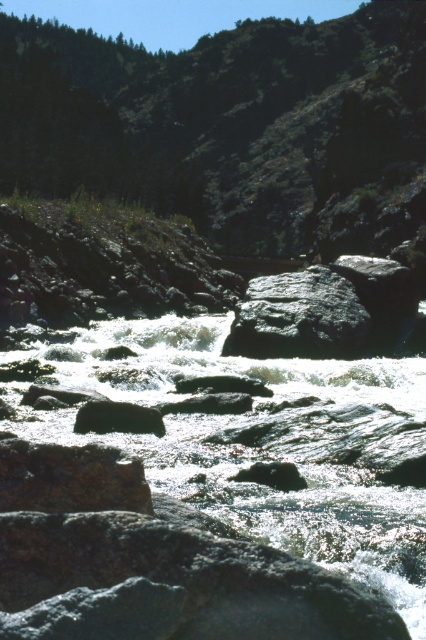
What do you see at coordinates (233, 128) in the screenshot? The image size is (426, 640). I see `green grassy hillside at upper center` at bounding box center [233, 128].

Who is more distant from viewer, (55,164) or (207,346)?

Positioned behind is point (55,164).

Find the location of a particular element. This screenshot has width=426, height=640. green grassy hillside at upper center is located at coordinates click(x=233, y=128).